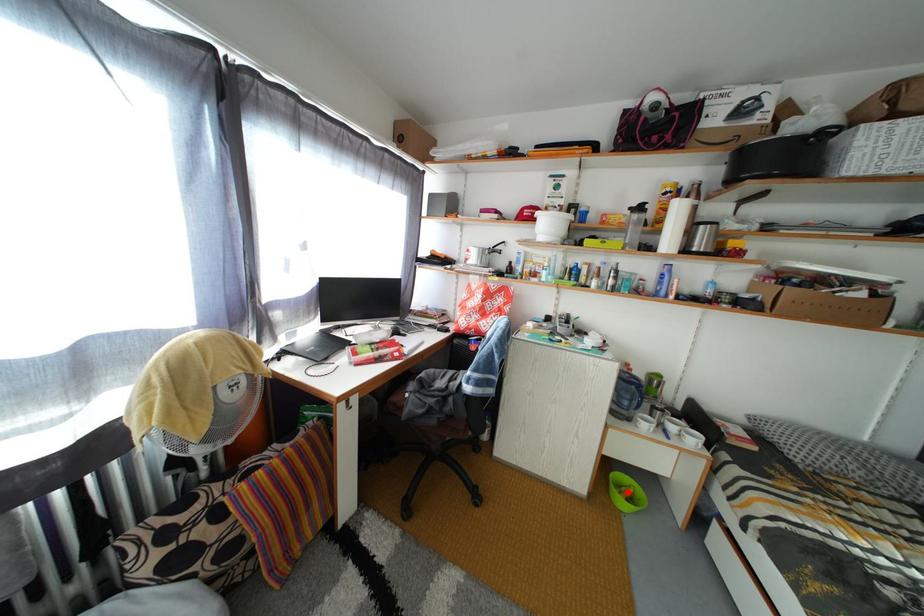
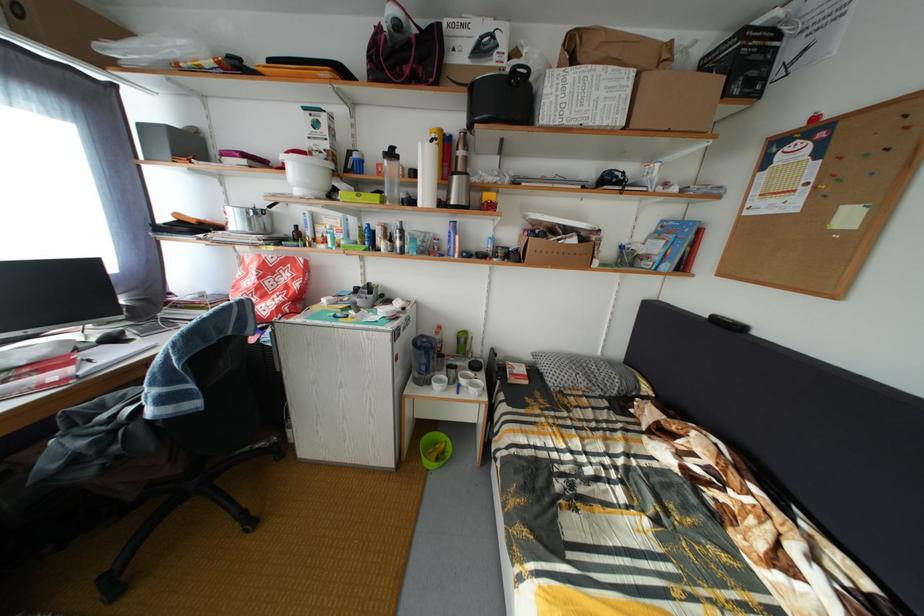
Question: I am providing you with two images of the same scene from different viewpoints. Image1 has a red point marked. In image2, the corresponding 3D location appears at what relative position? Reply with the corresponding letter.

Choices:
 (A) Closer
 (B) Farther

Answer: (A)